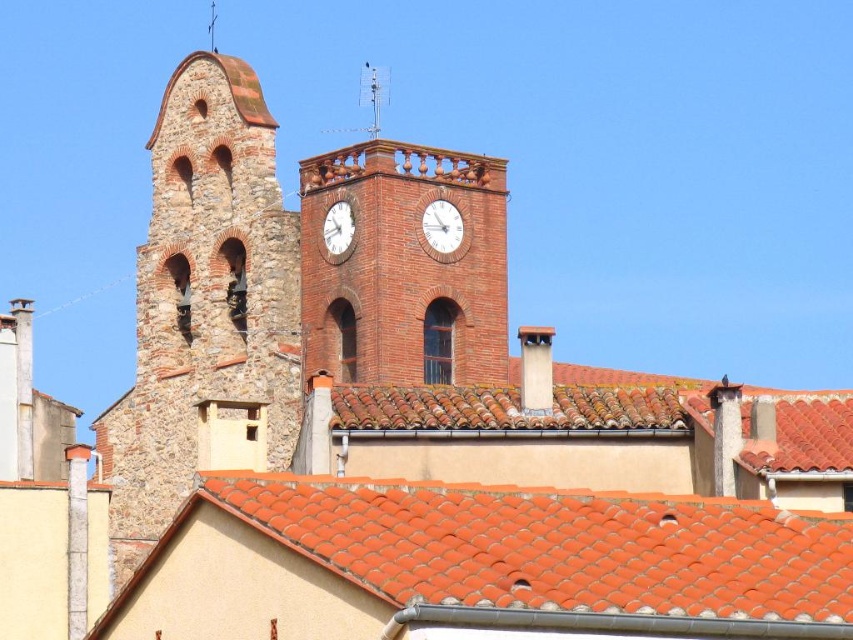
Question: Which point is closer to the camera?

Choices:
 (A) pos(834,616)
 (B) pos(451,208)
 (C) pos(412,209)
 (D) pos(339,232)

Answer: (A)

Question: Which point appears farthest from the camera in this image?

Choices:
 (A) (338, 516)
 (B) (344, 166)
 (C) (437, 234)

Answer: (B)

Question: Does orange clay tiles at lower center have a smaller size compared to white glossy clock at upper center?

Choices:
 (A) yes
 (B) no

Answer: (B)

Question: Which point appears closest to the camera in this image?

Choices:
 (A) (498, 304)
 (B) (653, 561)
 (C) (431, 218)
 (D) (325, 220)

Answer: (B)

Question: Does orange clay tiles at lower center have a smaller size compared to brick clock tower at center?

Choices:
 (A) no
 (B) yes

Answer: (B)

Question: Does orange clay tiles at lower center appear on the right side of white glossy clock at upper center?

Choices:
 (A) yes
 (B) no

Answer: (A)